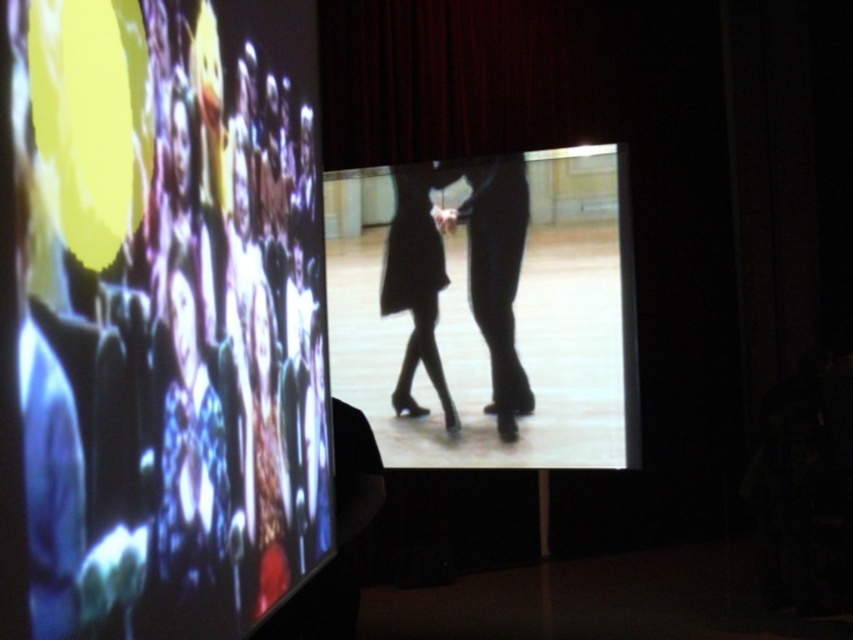
Between matte black screen at upper left and black matte dress at center, which one has less height?

With less height is matte black screen at upper left.

You are a GUI agent. You are given a task and a screenshot of the screen. Output one action in this format:
    pyautogui.click(x=<x>, y=<y>)
    Task: Click on the matte black screen at upper left
    This screenshot has width=853, height=640.
    Given the screenshot: What is the action you would take?
    pyautogui.click(x=160, y=316)

Between matte black screen at upper left and silhouette dress at center, which one is positioned higher?

Positioned higher is matte black screen at upper left.

Between matte black screen at upper left and silhouette dress at center, which one appears on the left side from the viewer's perspective?

matte black screen at upper left

Is point (320, 230) in front of point (381, 289)?

Yes, point (320, 230) is closer to viewer.

You are a GUI agent. You are given a task and a screenshot of the screen. Output one action in this format:
    pyautogui.click(x=<x>, y=<y>)
    Task: Click on the matte black screen at upper left
    This screenshot has height=640, width=853.
    Given the screenshot: What is the action you would take?
    pyautogui.click(x=160, y=316)

Is silhouette dress at center smaller than black matte dress at center?

No.

Does silhouette dress at center appear on the right side of black matte dress at center?

Indeed, silhouette dress at center is positioned on the right side of black matte dress at center.

What do you see at coordinates (492, 305) in the screenshot? The width and height of the screenshot is (853, 640). I see `silhouette dress at center` at bounding box center [492, 305].

In order to click on silhouette dress at center in this screenshot , I will do `click(492, 305)`.